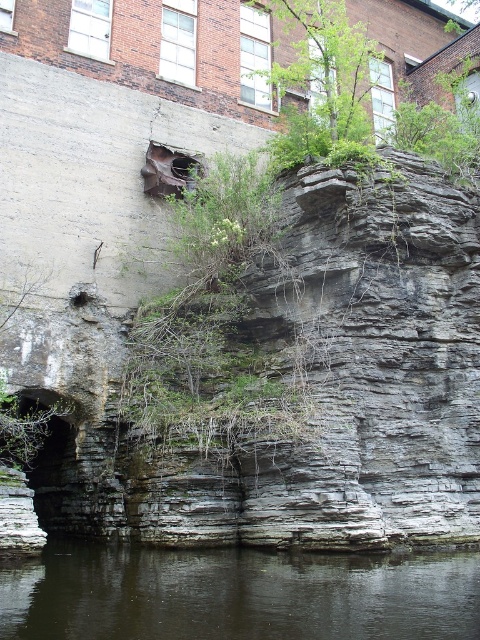
Does dark gray water at lower center have a lesser height compared to green leafy tree at upper center?

Correct, dark gray water at lower center is not as tall as green leafy tree at upper center.

Can you confirm if dark gray water at lower center is thinner than green leafy tree at upper center?

No, dark gray water at lower center is not thinner than green leafy tree at upper center.

Between point (479, 568) and point (288, 141), which one is positioned in front?

Point (479, 568) is more forward.

I want to click on dark gray water at lower center, so click(x=238, y=595).